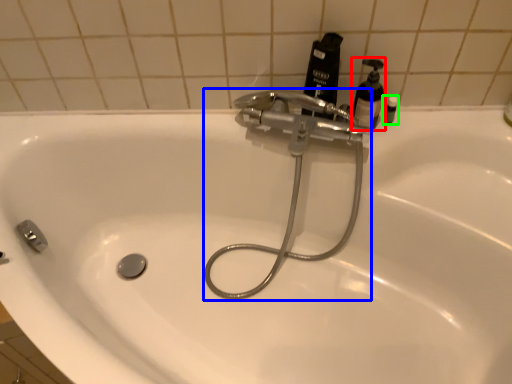
Question: Based on their relative distances, which object is nearer to soap dispenser (highlighted by a red box)? Choose from plumbing fixture (highlighted by a blue box) and toiletry (highlighted by a green box).

Choices:
 (A) plumbing fixture
 (B) toiletry

Answer: (B)